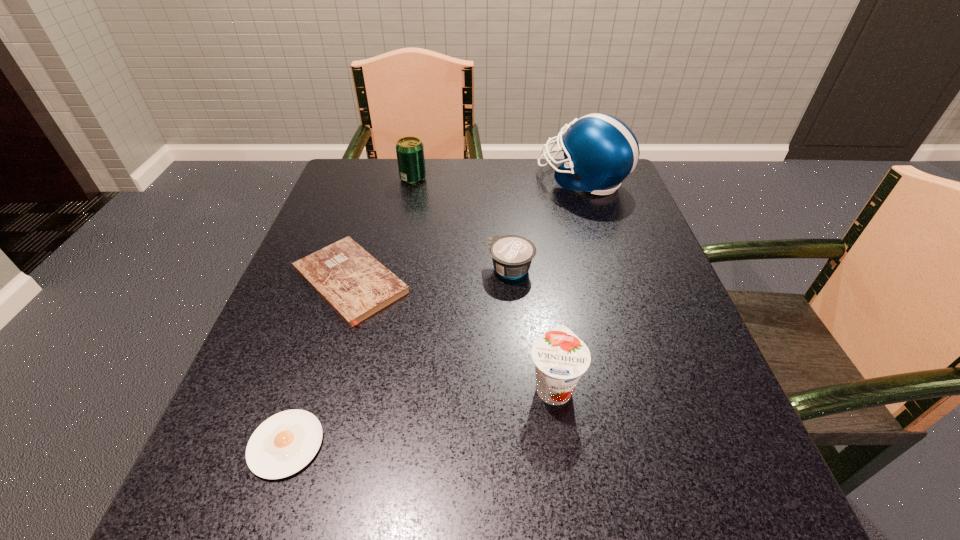
Where is `free space at the near right corner of the desktop`? The height and width of the screenshot is (540, 960). free space at the near right corner of the desktop is located at coordinates point(660,485).

At what (x,y) coordinates should I click in order to perform the action: click on vacant space in between the tallest object and the shortest object. Please return your answer as a coordinate pair (x, y). Looking at the image, I should click on (434, 312).

The height and width of the screenshot is (540, 960). I want to click on free space that is in between the egg yolk and the third shortest object, so click(x=398, y=357).

You are a GUI agent. You are given a task and a screenshot of the screen. Output one action in this format:
    pyautogui.click(x=<x>, y=<y>)
    Task: Click on the vacant area that lies between the football helmet and the egg yolk
    
    Given the screenshot: What is the action you would take?
    pyautogui.click(x=434, y=312)

Locate an element on the screen. vacant region between the beer can and the third tallest object is located at coordinates (483, 282).

At what (x,y) coordinates should I click in order to perform the action: click on empty space that is in between the nearer yogurt and the football helmet. Please return your answer as a coordinate pair (x, y). The width and height of the screenshot is (960, 540). Looking at the image, I should click on (568, 283).

Identify the location of free spot between the beer can and the nearer yogurt. The height and width of the screenshot is (540, 960). (483, 282).

Locate an element on the screen. empty space that is in between the shorter yogurt and the taller yogurt is located at coordinates (532, 328).

I want to click on vacant space in between the nearer yogurt and the shortest object, so click(420, 415).

This screenshot has height=540, width=960. What are the coordinates of `vacant point located between the shorter yogurt and the Bible` in the screenshot? It's located at (430, 275).